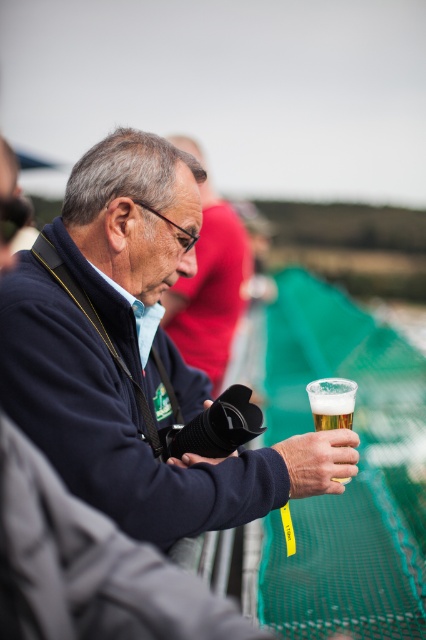
Consider the image. Between matte black jacket at center and translucent glass at center, which one has less height?

translucent glass at center

Does point (32, 321) come behind point (336, 419)?

No, (32, 321) is closer to viewer.

This screenshot has width=426, height=640. In order to click on matte black jacket at center in this screenshot , I will do pyautogui.click(x=134, y=355).

Can you confirm if matte black jacket at center is wider than matte black camera at center?

Correct, the width of matte black jacket at center exceeds that of matte black camera at center.

Who is shorter, matte black jacket at center or matte black camera at center?

With less height is matte black jacket at center.

Between point (236, 515) and point (183, 284), which one is positioned behind?

The point (183, 284) is more distant.

At what (x,y) coordinates should I click in order to perform the action: click on matte black jacket at center. Please return your answer as a coordinate pair (x, y). The height and width of the screenshot is (640, 426). Looking at the image, I should click on (134, 355).

Can you confirm if matte black camera at center is thinner than translucent glass at center?

Incorrect, matte black camera at center's width is not less than translucent glass at center's.

Measure the distance between point [238,316] and camera.

4.35 meters

Find the location of a particular element. The height and width of the screenshot is (640, 426). matte black camera at center is located at coordinates (210, 291).